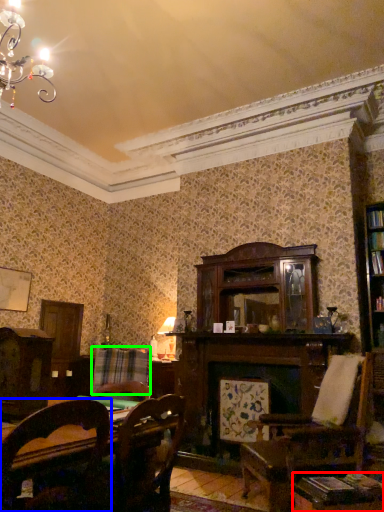
Question: Based on their relative distances, which object is farther from table (highlighted by a red box)? Choose from chair (highlighted by a blue box) and plaid (highlighted by a green box).

Choices:
 (A) chair
 (B) plaid

Answer: (B)